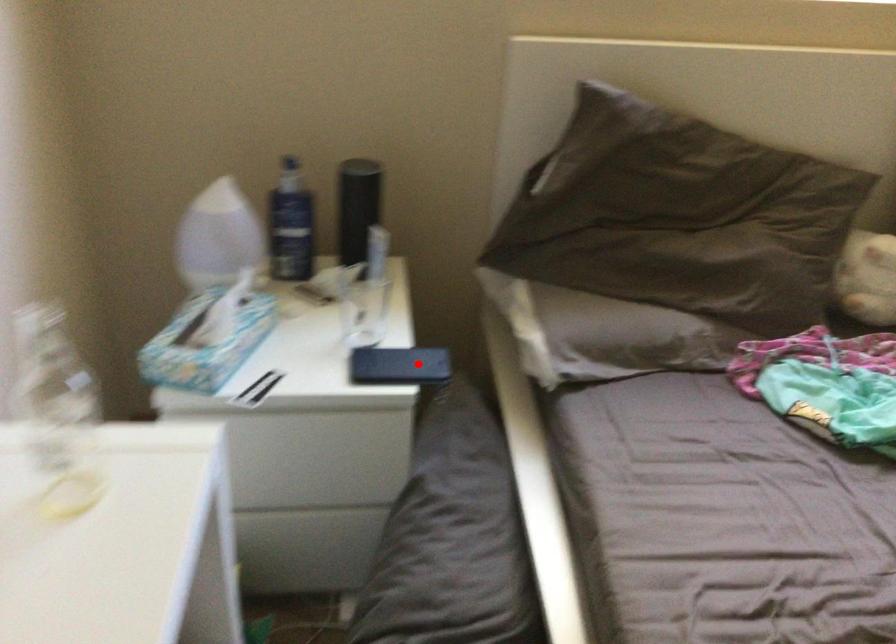
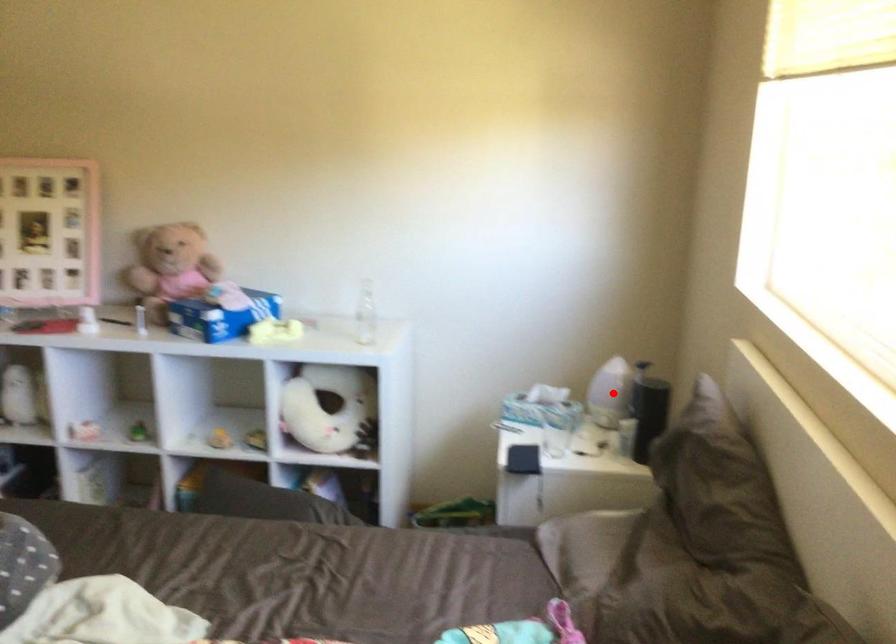
In the scene shown: I am providing you with two images of the same scene from different viewpoints. A red point is marked on the first image and another point is marked on the second image. Is the marked point in image1 the same physical position as the marked point in image2?

No